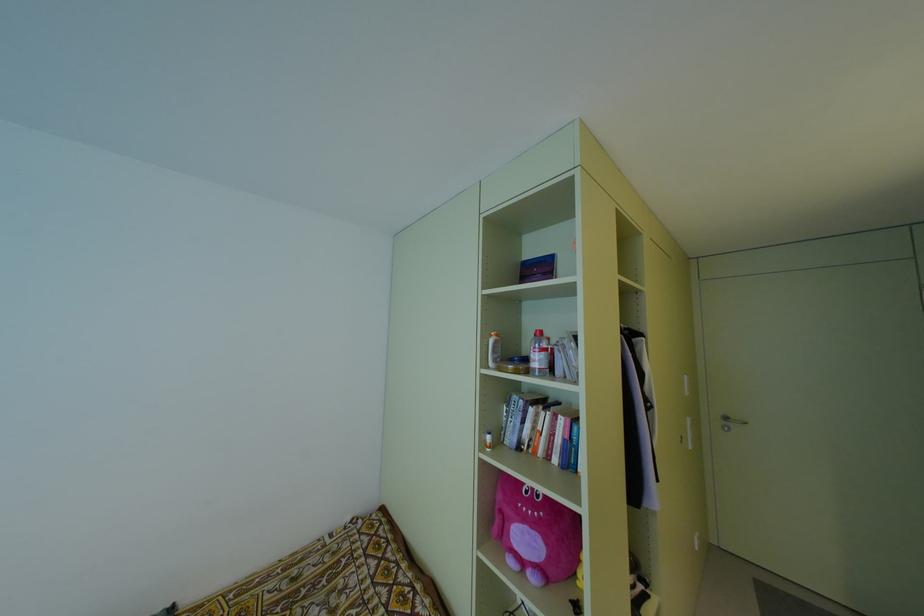
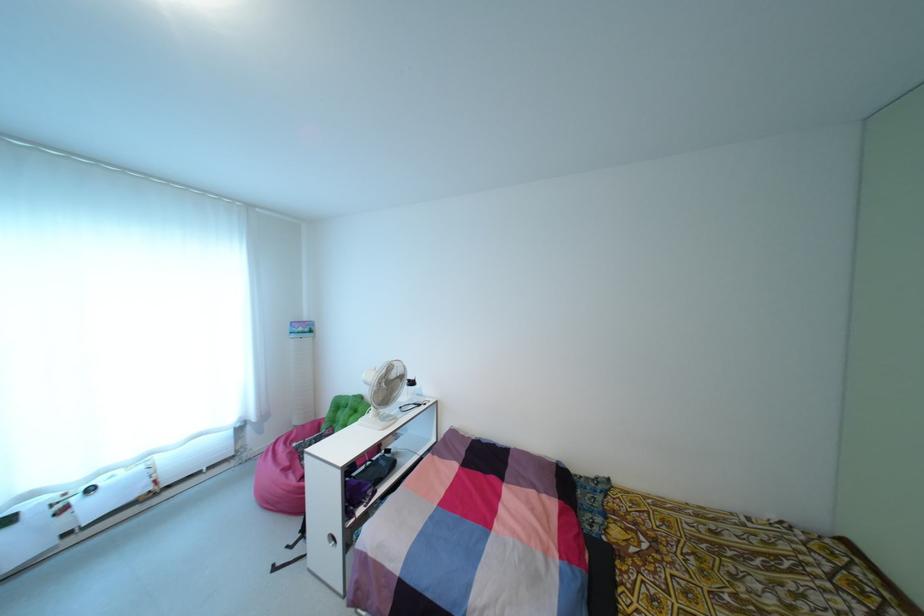
Question: The camera is either moving clockwise (left) or counter-clockwise (right) around the object. The first image is from the beginning of the video and the second image is from the end. Is the camera moving left or right when shooting the video?

Choices:
 (A) Left
 (B) Right

Answer: (B)